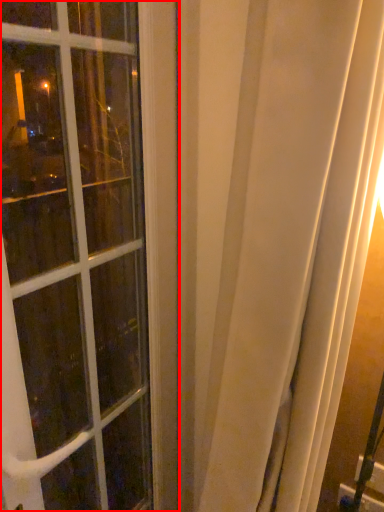
Question: From the image's perspective, considering the relative positions of window (annotated by the red box) and curtain in the image provided, where is window (annotated by the red box) located with respect to the staircase?

Choices:
 (A) above
 (B) below

Answer: (A)